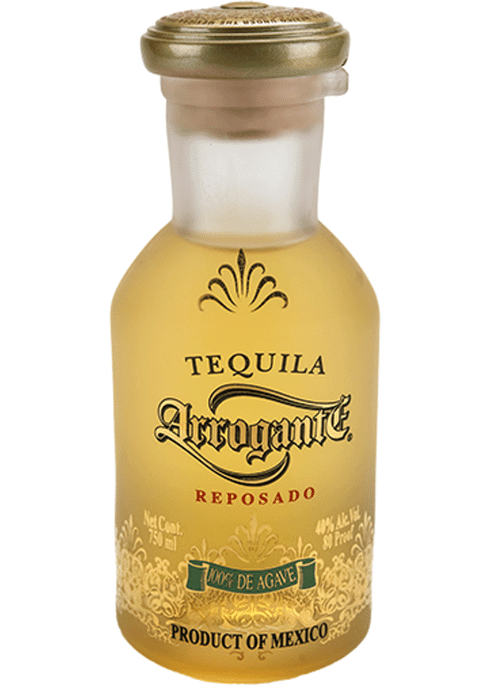
This screenshot has width=490, height=686. Identify the location of bottle lid. (270, 54).